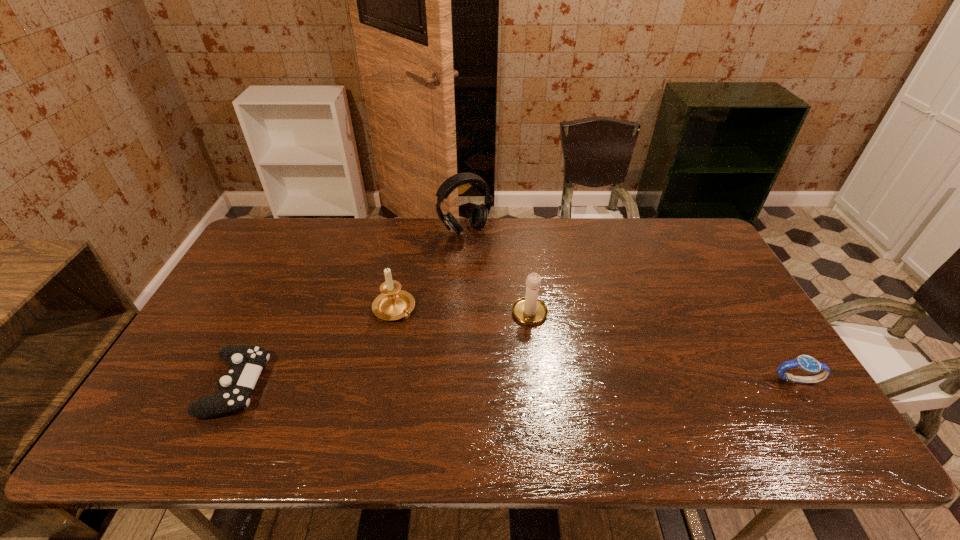
At what (x,y) coordinates should I click in order to perform the action: click on free region located on the ear cups of the third object from left to right. Please return your answer as a coordinate pair (x, y). This screenshot has width=960, height=540. Looking at the image, I should click on (505, 280).

Image resolution: width=960 pixels, height=540 pixels. I want to click on vacant space located with a handle on the side of the second object from left to right, so click(427, 337).

Find the location of a particular element. This screenshot has width=960, height=540. free space located with a handle on the side of the second object from left to right is located at coordinates (499, 397).

Find the location of a particular element. vacant region located 0.140m with a handle on the side of the second object from left to right is located at coordinates (440, 347).

The height and width of the screenshot is (540, 960). Find the location of `vacant space located on the handle side of the second object from right to left`. vacant space located on the handle side of the second object from right to left is located at coordinates coord(516,377).

Locate an element on the screen. vacant space located on the handle side of the second object from right to left is located at coordinates (516, 383).

Where is `free space located on the handle side of the second object from right to left`? This screenshot has height=540, width=960. free space located on the handle side of the second object from right to left is located at coordinates pyautogui.click(x=512, y=400).

The width and height of the screenshot is (960, 540). Identify the location of object present at the far edge. (479, 214).

This screenshot has height=540, width=960. I want to click on control located in the near edge section of the desktop, so click(x=246, y=362).

Locate an element on the screen. watch located in the near edge section of the desktop is located at coordinates (806, 363).